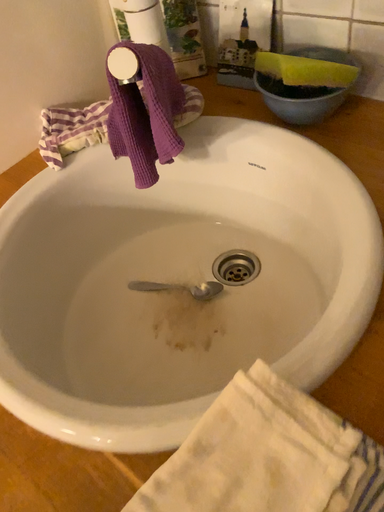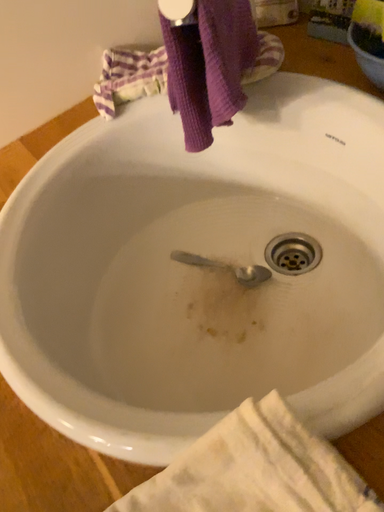
Question: How did the camera likely rotate when shooting the video?

Choices:
 (A) rotated left
 (B) rotated right

Answer: (A)